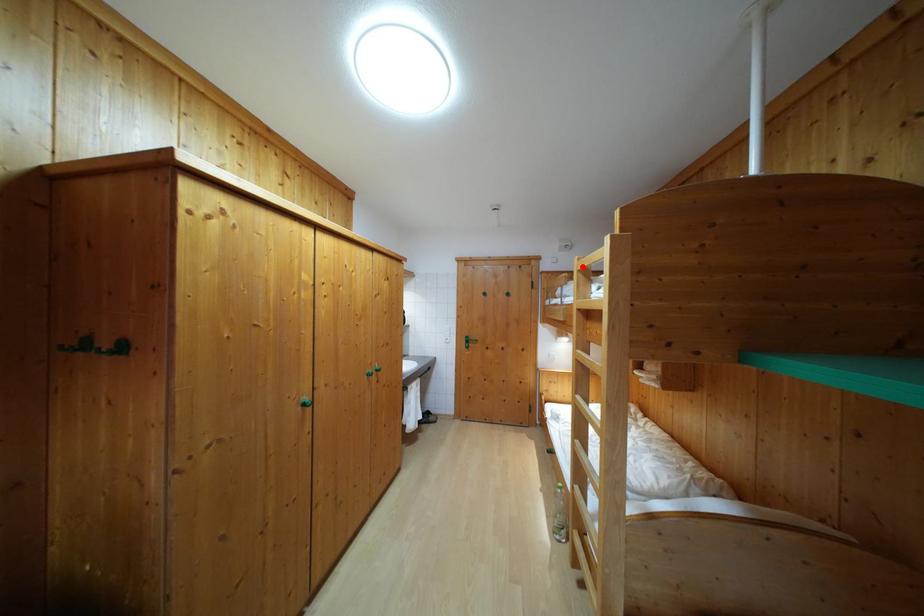
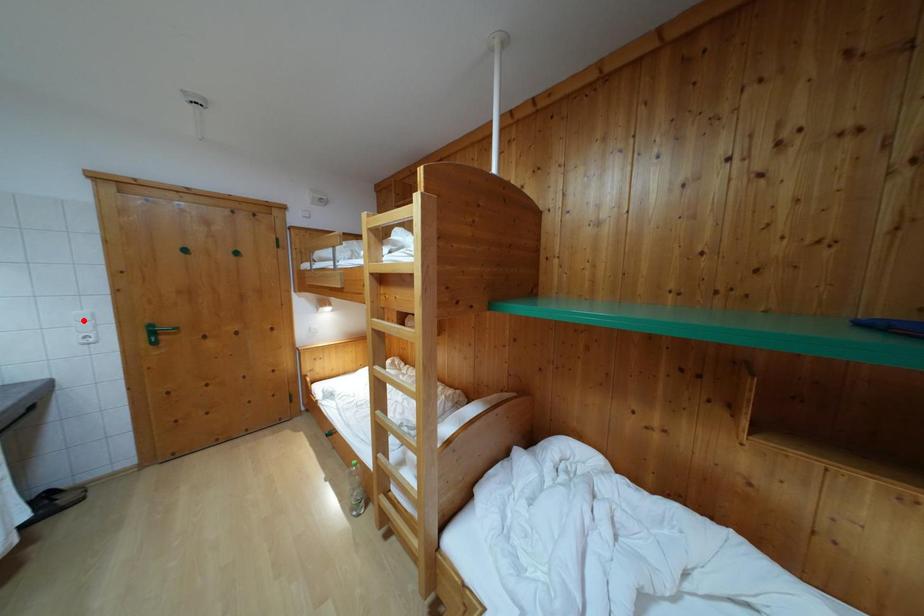
I am providing you with two images of the same scene from different viewpoints. A red point is marked on the first image and another point is marked on the second image. Is the marked point in image1 the same physical position as the marked point in image2?

No